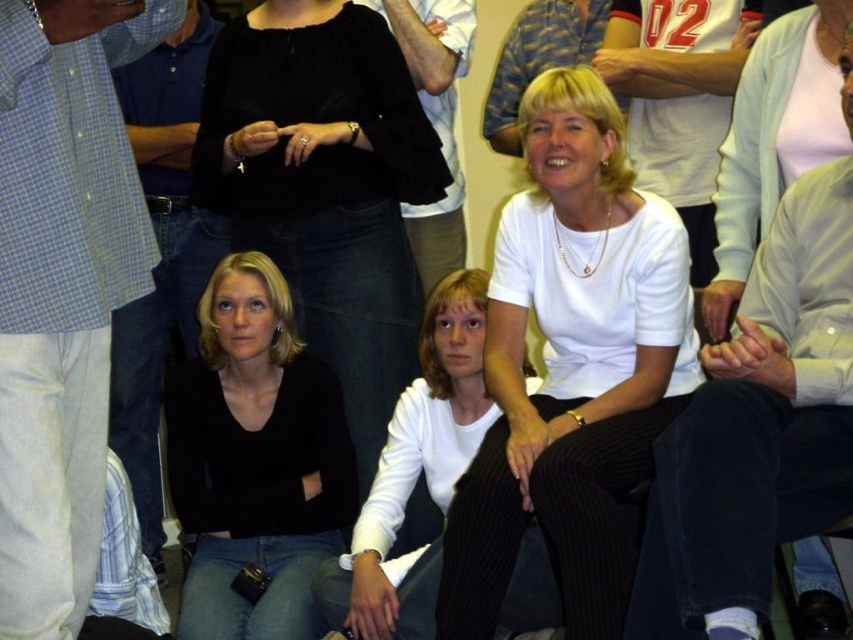
In the scene, there are two shirts visible on the people. The white matte shirt at center and the light blue checkered shirt at left. Which shirt is bigger in size?

The white matte shirt at center is larger in size compared to the light blue checkered shirt at left.

You are standing in the room and want to greet the person wearing the white matte shirt at center and the light blue checkered shirt at left. Which one is closer to your left side?

The light blue checkered shirt at left is closer to your left side because it is positioned to the left of the white matte shirt at center.